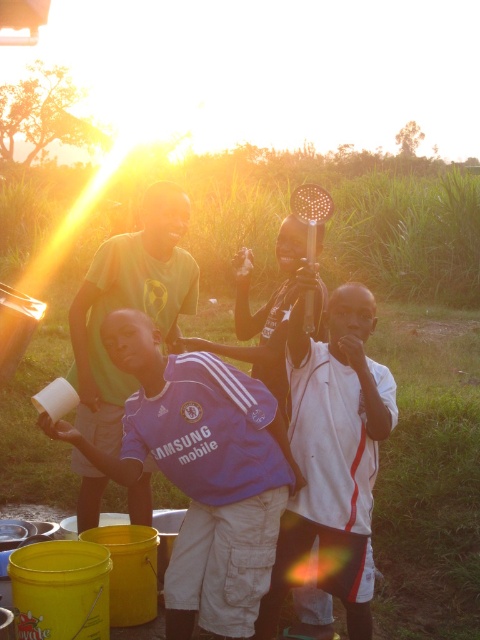
Is purple jersey at center to the right of white jersey at center from the viewer's perspective?

No, purple jersey at center is not to the right of white jersey at center.

Is purple jersey at center thinner than white jersey at center?

No.

Identify the location of purple jersey at center. The height and width of the screenshot is (640, 480). (202, 472).

Is white jersey at center to the right of green matte shirt at center from the viewer's perspective?

Indeed, white jersey at center is positioned on the right side of green matte shirt at center.

How distant is white jersey at center from green matte shirt at center?

A distance of 1.14 meters exists between white jersey at center and green matte shirt at center.

The width and height of the screenshot is (480, 640). What do you see at coordinates (334, 458) in the screenshot?
I see `white jersey at center` at bounding box center [334, 458].

Where is `white jersey at center`? white jersey at center is located at coordinates (334, 458).

In the scene shown: Does green matte shirt at center have a lesser height compared to black plastic comb at center?

Incorrect, green matte shirt at center's height does not fall short of black plastic comb at center's.

Does point (183, 289) come farther from viewer compared to point (267, 328)?

Yes.

Locate an element on the screen. This screenshot has height=640, width=480. green matte shirt at center is located at coordinates (129, 307).